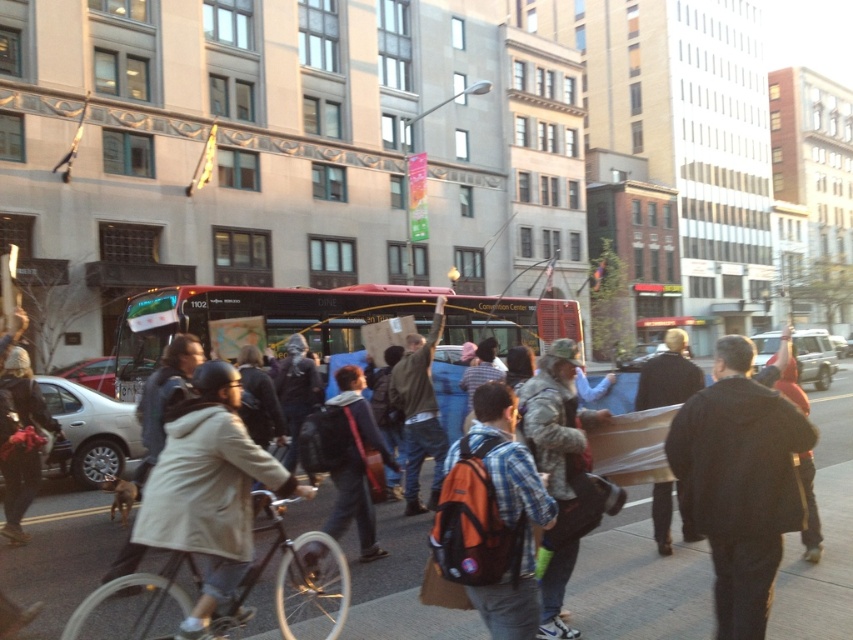
You are a pedestrian trying to cross the street and notice the black leather jacket at center and the silver metallic sedan at left. Which object is larger in size?

The black leather jacket at center is bigger than the silver metallic sedan at left.